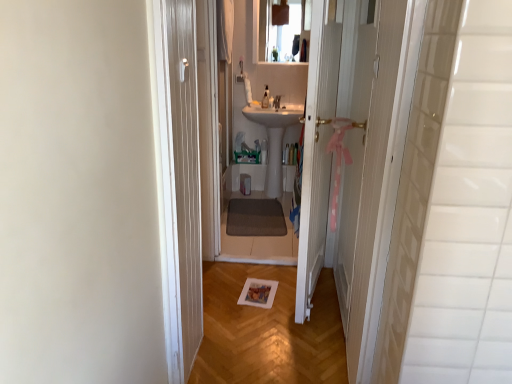
At what (x,y) coordinates should I click in order to perform the action: click on white wooden door at center. Please return your answer as a coordinate pair (x, y). Looking at the image, I should click on (317, 153).

Describe the element at coordinates (280, 32) in the screenshot. The width and height of the screenshot is (512, 384). I see `clear glass mirror at upper center` at that location.

The height and width of the screenshot is (384, 512). I want to click on clear glass mirror at upper center, so click(280, 32).

This screenshot has width=512, height=384. What do you see at coordinates (354, 154) in the screenshot? I see `pink ribbon at right` at bounding box center [354, 154].

Where is `white wooden door at center`? white wooden door at center is located at coordinates (317, 153).

How many degrees apart are the facing directions of white glossy sink at center and clear glass mirror at upper center?

The facing directions of white glossy sink at center and clear glass mirror at upper center are 6.92e-05 degrees apart.

Which is in front, point (283, 117) or point (266, 19)?

The point (266, 19) is closer.

Is white glossy sink at center beside clear glass mirror at upper center?

No.

From the image's perspective, is white glossy sink at center on clear glass mirror at upper center?

No, from the image's perspective, white glossy sink at center is not above clear glass mirror at upper center.

Could you tell me if white wooden door at center is facing white glossy sink at center?

No, white wooden door at center is not oriented towards white glossy sink at center.

From the image's perspective, which is above, white wooden door at center or white glossy sink at center?

white glossy sink at center.

Is the position of white wooden door at center more distant than that of white glossy sink at center?

That is False.

Are white wooden door at center and white glossy sink at center making contact?

white wooden door at center is not next to white glossy sink at center, and they're not touching.

Considering the sizes of objects pink ribbon at right and white wooden door at center in the image provided, who is wider, pink ribbon at right or white wooden door at center?

Wider between the two is white wooden door at center.

Considering the sizes of objects pink ribbon at right and white wooden door at center in the image provided, who is shorter, pink ribbon at right or white wooden door at center?

With less height is pink ribbon at right.

From a real-world perspective, is pink ribbon at right located beneath white wooden door at center?

No, from a real-world perspective, pink ribbon at right is not below white wooden door at center.

In terms of width, does pink ribbon at right look wider or thinner when compared to white glossy sink at center?

Clearly, pink ribbon at right has less width compared to white glossy sink at center.

Is pink ribbon at right positioned far away from white glossy sink at center?

Absolutely, pink ribbon at right is distant from white glossy sink at center.

Is point (344, 329) closer or farther from the camera than point (298, 106)?

Point (344, 329) is positioned closer to the camera compared to point (298, 106).

Who is taller, pink ribbon at right or white glossy sink at center?

pink ribbon at right is taller.

Can you tell me how much white wooden door at center and pink ribbon at right differ in facing direction?

They differ by 13.6 degrees in their facing directions.

This screenshot has width=512, height=384. Identify the location of screen door positioned vertically above the white wooden door at center (from a real-world perspective). (354, 154).

Would you consider white wooden door at center to be distant from pink ribbon at right?

white wooden door at center is actually quite close to pink ribbon at right.

Is point (327, 142) positioned in front of point (356, 175)?

Yes, it is.

Which is less distant, (x=274, y=178) or (x=348, y=257)?

The point (x=348, y=257) is closer to the camera.

Consider the image. Can you confirm if white glossy sink at center is smaller than pink ribbon at right?

No, white glossy sink at center is not smaller than pink ribbon at right.

From a real-world perspective, which object rests below the other?

In real-world perspective, white glossy sink at center is lower.

Does clear glass mirror at upper center have a greater width compared to white glossy sink at center?

Incorrect, the width of clear glass mirror at upper center does not surpass that of white glossy sink at center.

Measure the distance from clear glass mirror at upper center to white glossy sink at center.

clear glass mirror at upper center and white glossy sink at center are 28.66 inches apart.

Is clear glass mirror at upper center not within white glossy sink at center?

Yes, clear glass mirror at upper center is not within white glossy sink at center.

Are clear glass mirror at upper center and white glossy sink at center located far from each other?

No, there isn't a large distance between clear glass mirror at upper center and white glossy sink at center.

At what (x,y) coordinates should I click in order to perform the action: click on sink beneath the clear glass mirror at upper center (from a real-world perspective). Please return your answer as a coordinate pair (x, y). This screenshot has width=512, height=384. Looking at the image, I should click on (274, 140).

The width and height of the screenshot is (512, 384). I want to click on door below the white glossy sink at center (from the image's perspective), so click(317, 153).

Looking at the image, which one is located closer to white glossy sink at center, white wooden door at center or pink ribbon at right?

pink ribbon at right lies closer to white glossy sink at center than the other object.

Which object lies nearer to the anchor point clear glass mirror at upper center, pink ribbon at right or white glossy sink at center?

white glossy sink at center is positioned closer to the anchor clear glass mirror at upper center.

Based on their spatial positions, is pink ribbon at right or white glossy sink at center closer to white wooden door at center?

Among the two, pink ribbon at right is located nearer to white wooden door at center.

Considering their positions, is white glossy sink at center positioned further to pink ribbon at right than clear glass mirror at upper center?

Based on the image, clear glass mirror at upper center appears to be further to pink ribbon at right.

Looking at the image, which one is located further to white glossy sink at center, clear glass mirror at upper center or pink ribbon at right?

Among the two, pink ribbon at right is located further to white glossy sink at center.

Estimate the real-world distances between objects in this image. Which object is further from clear glass mirror at upper center, white wooden door at center or white glossy sink at center?

Based on the image, white wooden door at center appears to be further to clear glass mirror at upper center.

Which object lies nearer to the anchor point white glossy sink at center, pink ribbon at right or clear glass mirror at upper center?

The object closer to white glossy sink at center is clear glass mirror at upper center.

When comparing their distances from white wooden door at center, does pink ribbon at right or clear glass mirror at upper center seem further?

clear glass mirror at upper center is further to white wooden door at center.

You are a GUI agent. You are given a task and a screenshot of the screen. Output one action in this format:
    pyautogui.click(x=<x>, y=<y>)
    Task: Click on the screen door positioned between white wooden door at center and clear glass mirror at upper center from near to far
    The height and width of the screenshot is (384, 512).
    Given the screenshot: What is the action you would take?
    pyautogui.click(x=354, y=154)

In order to click on screen door between white wooden door at center and white glossy sink at center along the z-axis in this screenshot , I will do (x=354, y=154).

You are a GUI agent. You are given a task and a screenshot of the screen. Output one action in this format:
    pyautogui.click(x=<x>, y=<y>)
    Task: Click on the sink between white wooden door at center and clear glass mirror at upper center along the z-axis
    This screenshot has width=512, height=384.
    Given the screenshot: What is the action you would take?
    pyautogui.click(x=274, y=140)

The height and width of the screenshot is (384, 512). In order to click on sink between pink ribbon at right and clear glass mirror at upper center in the front-back direction in this screenshot , I will do `click(274, 140)`.